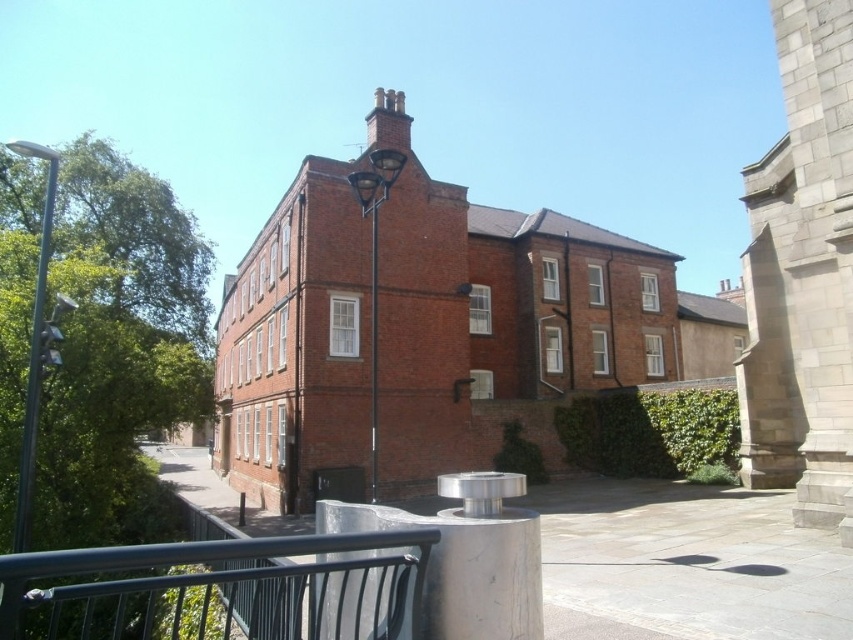
You are a delivery person needing to park your 2.5 meter wide delivery van between the metallic pole at left and the metallic silver streetlamp at center. Is there enough space for the van to fit between them?

The distance between the metallic pole at left and the metallic silver streetlamp at center is 6.84 meters. Since the van is 2.5 meters wide, there is sufficient space as 6.84 meters is greater than 2.5 meters.

You are standing in front of the brick building and want to walk from the metallic pole at left to the green leafy hedge at center. Which direction should you move relative to the pole?

To move from the metallic pole at left to the green leafy hedge at center, you should move to the right since the green leafy hedge at center is positioned on the right side of the metallic pole at left.